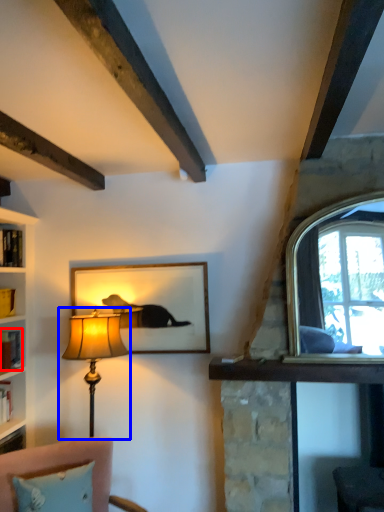
Question: Which object appears farthest to the camera in this image, book (highlighted by a red box) or lamp (highlighted by a blue box)?

Choices:
 (A) book
 (B) lamp

Answer: (A)